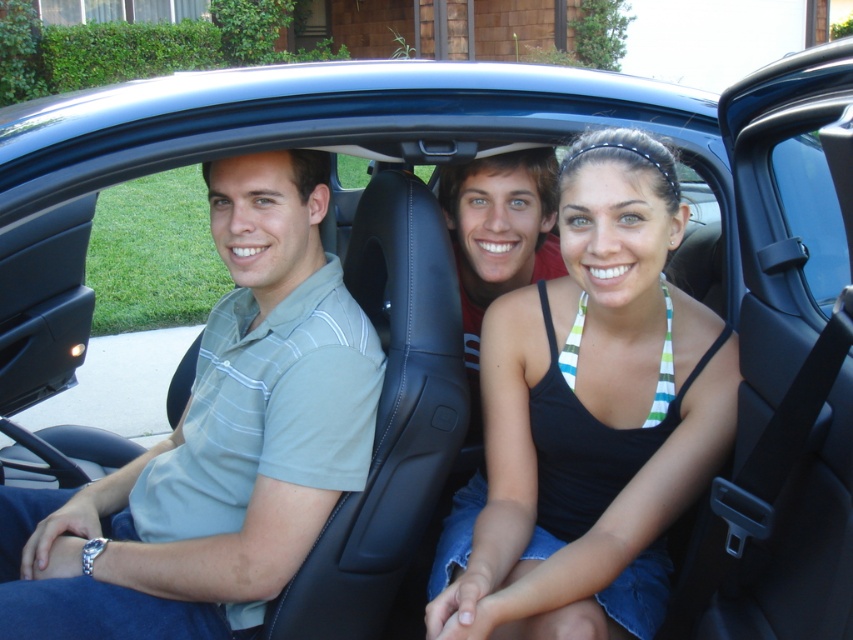
Question: Is black tank top at center to the left of gray striped polo shirt at left from the viewer's perspective?

Choices:
 (A) no
 (B) yes

Answer: (A)

Question: Can you confirm if black tank top at center is smaller than gray striped polo shirt at left?

Choices:
 (A) yes
 (B) no

Answer: (A)

Question: Among these points, which one is farthest from the camera?

Choices:
 (A) (294, 321)
 (B) (593, 561)

Answer: (A)

Question: Observing the image, what is the correct spatial positioning of black tank top at center in reference to gray striped polo shirt at left?

Choices:
 (A) right
 (B) left

Answer: (A)

Question: Which point is farther to the camera?

Choices:
 (A) gray striped polo shirt at left
 (B) black tank top at center

Answer: (B)